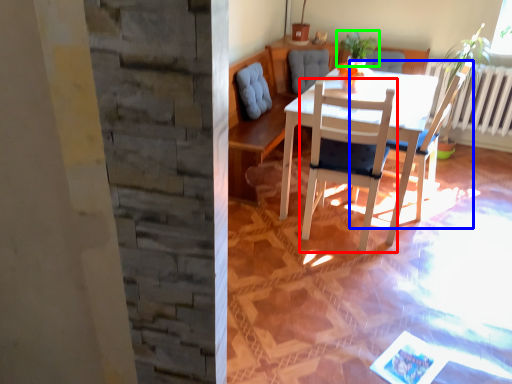
Question: Estimate the real-world distances between objects in this image. Which object is closer to chair (highlighted by a red box), chair (highlighted by a blue box) or houseplant (highlighted by a green box)?

Choices:
 (A) chair
 (B) houseplant

Answer: (A)